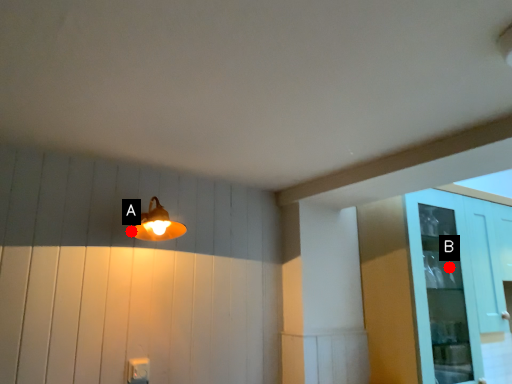
Question: Two points are circled on the image, labeled by A and B beside each circle. Which of the following is the closest to the observer?

Choices:
 (A) A is closer
 (B) B is closer

Answer: (A)